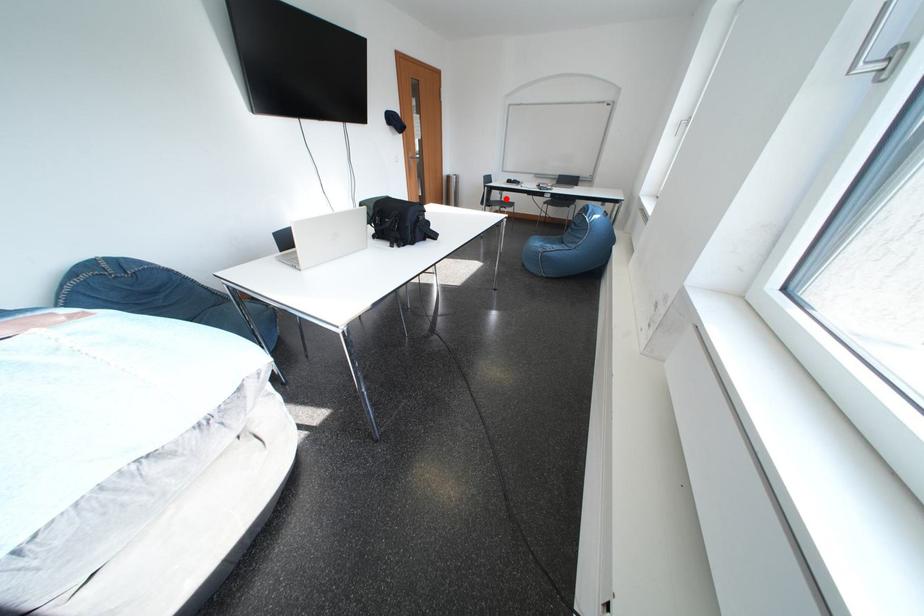
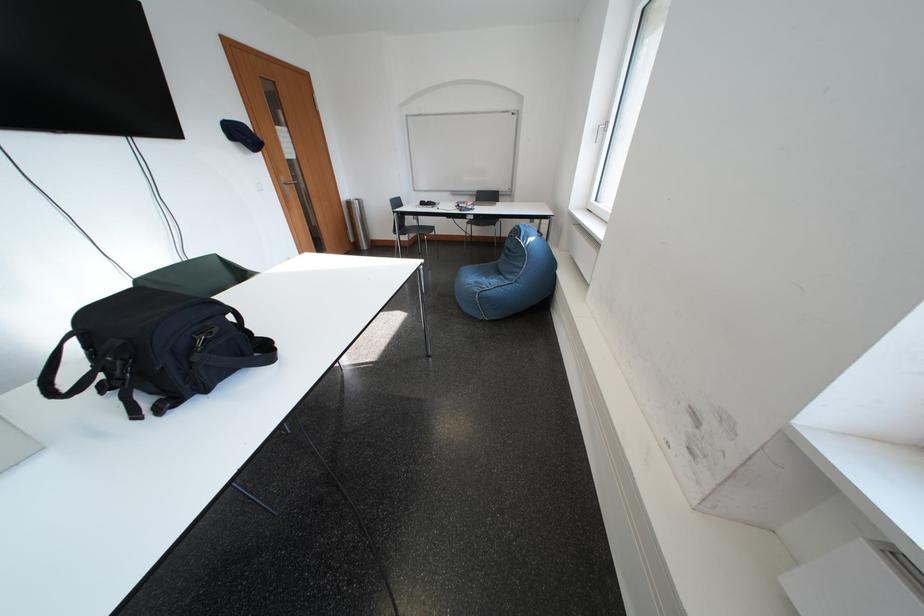
The point at the highlighted location is marked in the first image. Where is the corresponding point in the second image?

(420, 225)